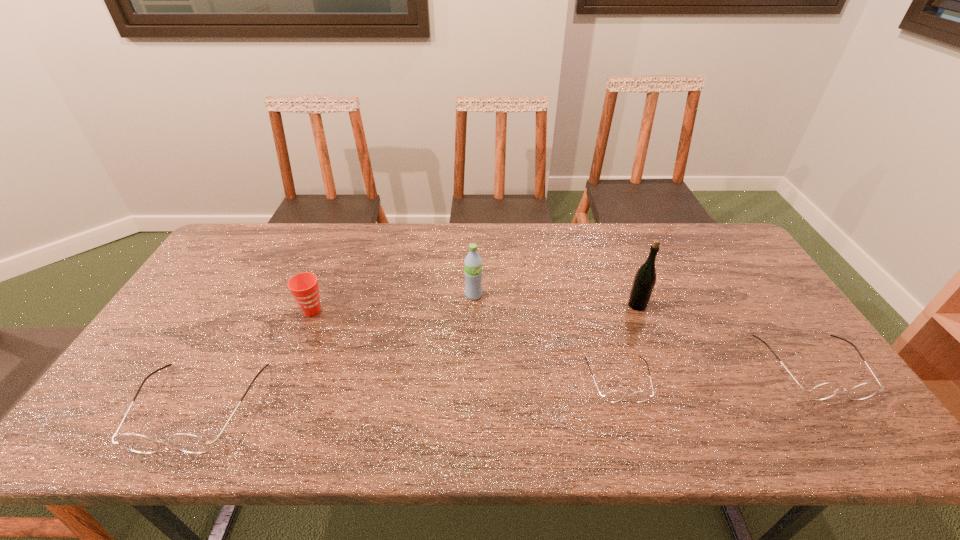
This screenshot has width=960, height=540. Identify the location of cup. (304, 286).

Find the location of `free region located 0.230m on the back of the beer bottle`. free region located 0.230m on the back of the beer bottle is located at coordinates (616, 251).

Where is `vacant area situated on the right of the second tallest object`? The height and width of the screenshot is (540, 960). vacant area situated on the right of the second tallest object is located at coordinates (536, 295).

This screenshot has height=540, width=960. I want to click on free region located on the back of the cup, so click(x=334, y=257).

You are a GUI agent. You are given a task and a screenshot of the screen. Output one action in this format:
    pyautogui.click(x=<x>, y=<y>)
    Task: Click on the object located in the left edge section of the desktop
    The height and width of the screenshot is (540, 960).
    Given the screenshot: What is the action you would take?
    pyautogui.click(x=189, y=443)

Identify the location of object that is at the right edge. The width and height of the screenshot is (960, 540). (823, 391).

At what (x,y) coordinates should I click in order to perform the action: click on object situated at the near left corner. Please return your answer as a coordinate pair (x, y). Image resolution: width=960 pixels, height=540 pixels. Looking at the image, I should click on (189, 443).

Identify the location of object that is at the near right corner. (823, 391).

Locate an element on the screen. This screenshot has height=540, width=960. free point at the far edge is located at coordinates (328, 251).

The width and height of the screenshot is (960, 540). In the image, there is a desktop. Identify the location of vacant space at the near edge. (492, 379).